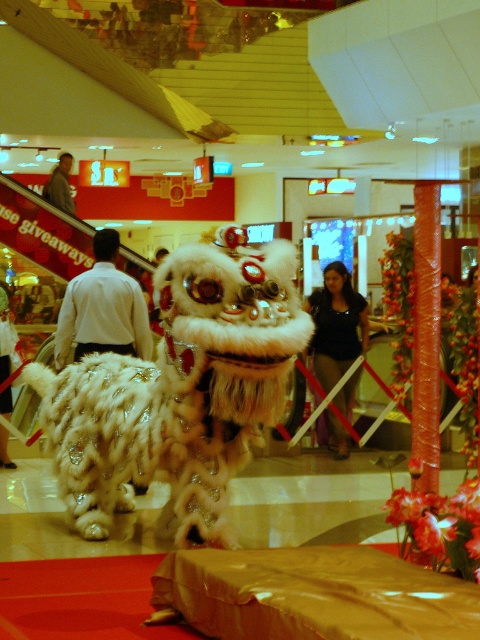
You are a photographer standing at the back of the mall and want to capture a clear photo of the white fluffy lion at center without the gray fabric jacket at upper left blocking the view. Is this possible based on their positions?

Yes, the white fluffy lion at center is in front of the gray fabric jacket at upper left, so the lion will block the jacket from view, allowing you to take a clear photo of the lion without the jacket obstructing it.

You are standing in the shopping mall and want to take a photo of the lion dance performance. You notice two points marked in the scene. Which point is closer to you, point (94, 237) or point (336, 323)?

Point (94, 237) is closer to the camera than point (336, 323), so the point (94, 237) is closer to you.